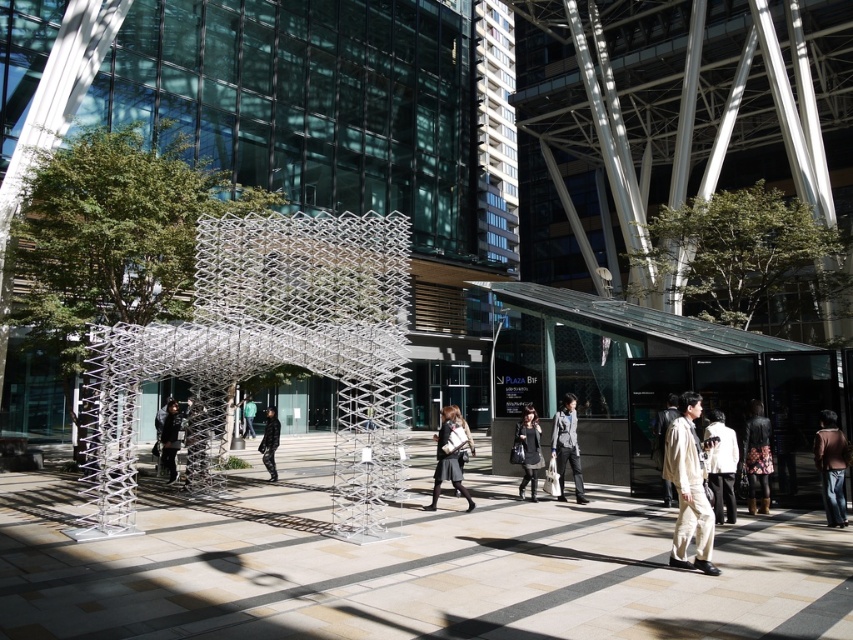
Does light beige fabric pants at lower right have a smaller size compared to light beige fabric coat at center?

Indeed, light beige fabric pants at lower right has a smaller size compared to light beige fabric coat at center.

Does light beige fabric pants at lower right appear under light beige fabric coat at center?

Actually, light beige fabric pants at lower right is above light beige fabric coat at center.

At what (x,y) coordinates should I click in order to perform the action: click on light beige fabric pants at lower right. Please return your answer as a coordinate pair (x, y). Looking at the image, I should click on (689, 488).

Is point (711, 474) less distant than point (525, 467)?

Yes.

Does white cotton shirt at lower right come behind black leather coat at center?

No, white cotton shirt at lower right is in front of black leather coat at center.

Between point (706, 454) and point (531, 474), which one is positioned behind?

The point (531, 474) is behind.

The height and width of the screenshot is (640, 853). In order to click on white cotton shirt at lower right in this screenshot , I will do `click(721, 465)`.

Does light beige fabric pants at lower right appear on the left side of dark gray fabric bag at center?

In fact, light beige fabric pants at lower right is to the right of dark gray fabric bag at center.

Which is in front, point (666, 465) or point (462, 476)?

Point (666, 465) is more forward.

Does point (711, 440) come closer to viewer compared to point (460, 480)?

Yes, it is.

Locate an element on the screen. light beige fabric pants at lower right is located at coordinates (689, 488).